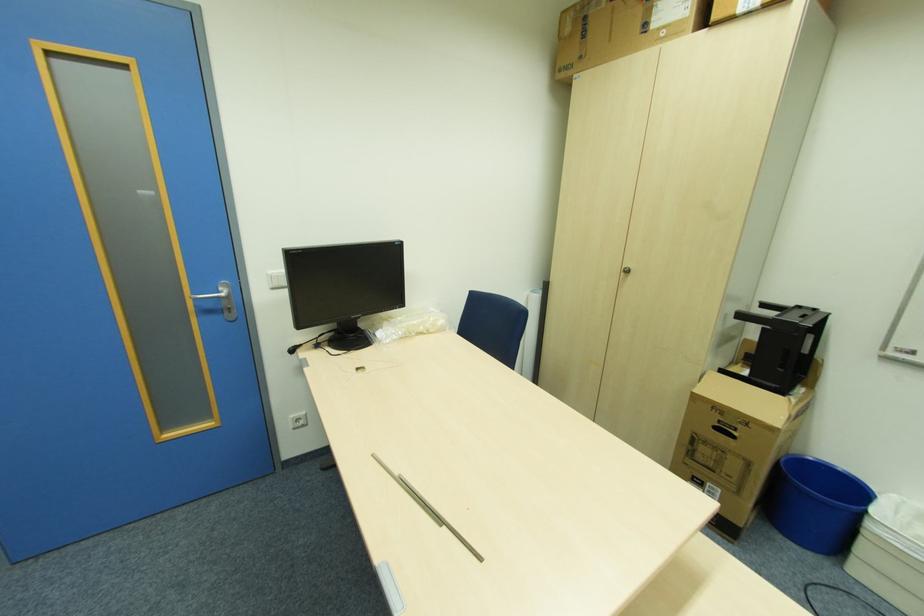
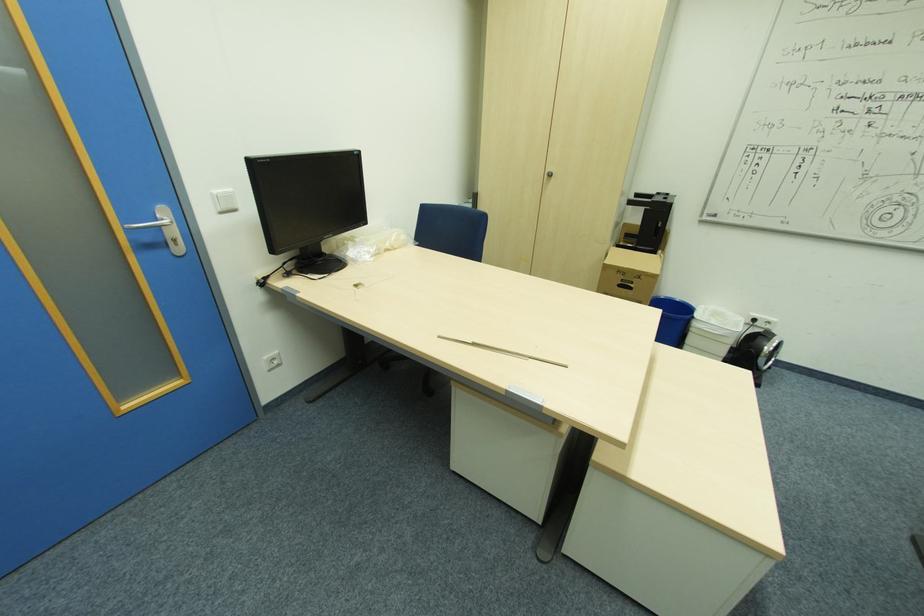
The point at (223, 291) is marked in the first image. Where is the corresponding point in the second image?

(161, 220)